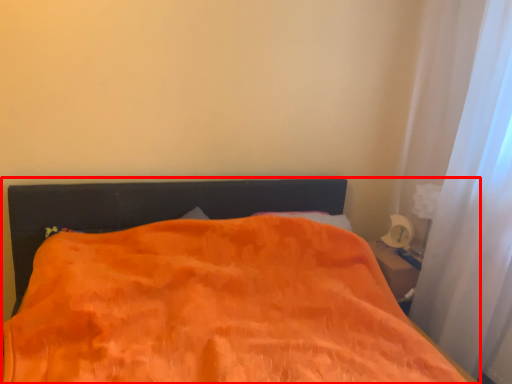
Question: Where is bed (annotated by the red box) located in relation to curtain in the image?

Choices:
 (A) right
 (B) left

Answer: (B)